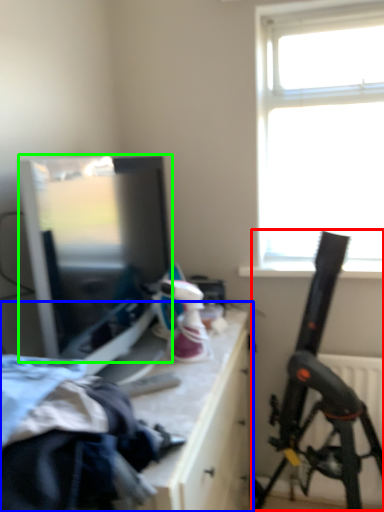
Question: Which is nearer to the weapon (highlighted by a red box)? table (highlighted by a blue box) or window screen (highlighted by a green box).

Choices:
 (A) table
 (B) window screen

Answer: (A)